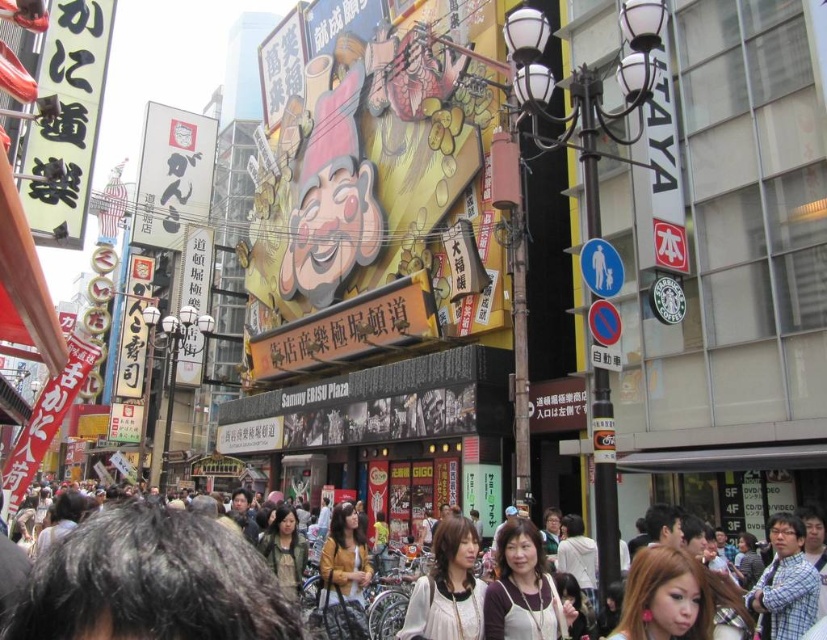
Question: Which point is farther from the camera taking this photo?

Choices:
 (A) (801, 593)
 (B) (515, 557)
 (C) (60, 627)
 (D) (409, 600)

Answer: (D)

Question: Which point is closer to the camera?

Choices:
 (A) (149, 512)
 (B) (534, 568)
 (C) (780, 609)
 (D) (448, 627)

Answer: (A)

Question: Can you confirm if multicolored clothing at center is positioned to the right of plaid shirt at lower right?

Choices:
 (A) yes
 (B) no

Answer: (B)

Question: Does multicolored clothing at center appear under matte brown hair at center?

Choices:
 (A) no
 (B) yes

Answer: (A)

Question: Which object appears farthest from the camera in this image?

Choices:
 (A) matte white blouse at center
 (B) plaid shirt at lower right
 (C) matte brown hair at center
 (D) multicolored clothing at center

Answer: (A)

Question: Does multicolored clothing at center have a larger size compared to plaid shirt at lower right?

Choices:
 (A) yes
 (B) no

Answer: (A)